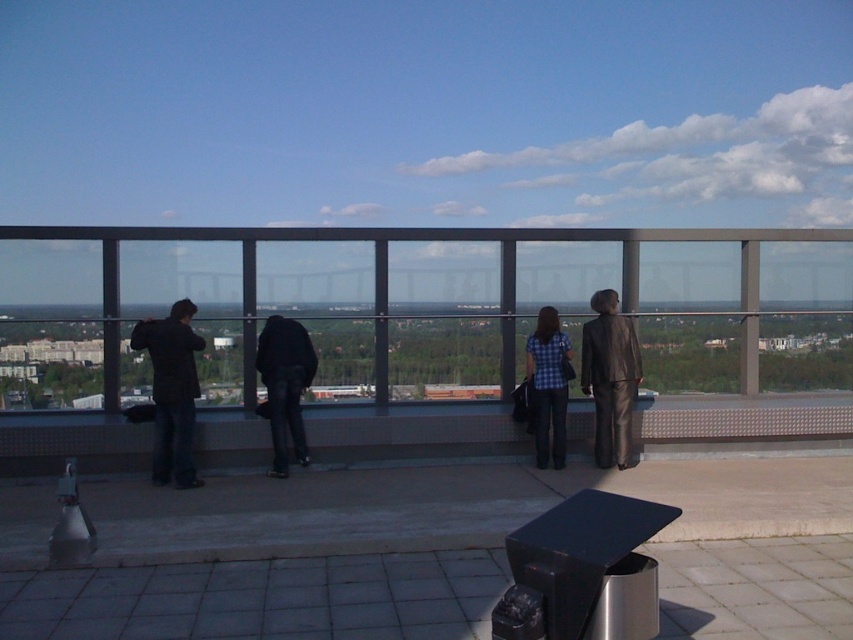
Question: Does shiny brown suit at right appear on the right side of blue plaid shirt at center?

Choices:
 (A) yes
 (B) no

Answer: (A)

Question: Which point appears farthest from the camera in this image?

Choices:
 (A) (172, 307)
 (B) (262, 344)
 (C) (548, 458)
 (D) (608, 426)

Answer: (C)

Question: Considering the real-world distances, which object is farthest from the black matte pants at center?

Choices:
 (A) shiny brown suit at right
 (B) black matte jacket at left

Answer: (A)

Question: Does shiny brown suit at right appear on the right side of blue plaid shirt at center?

Choices:
 (A) yes
 (B) no

Answer: (A)

Question: Is the position of black matte jacket at left more distant than that of blue plaid shirt at center?

Choices:
 (A) no
 (B) yes

Answer: (A)

Question: Which of the following is the farthest from the observer?

Choices:
 (A) (593, 365)
 (B) (189, 364)
 (C) (268, 340)
 (D) (525, 349)

Answer: (D)